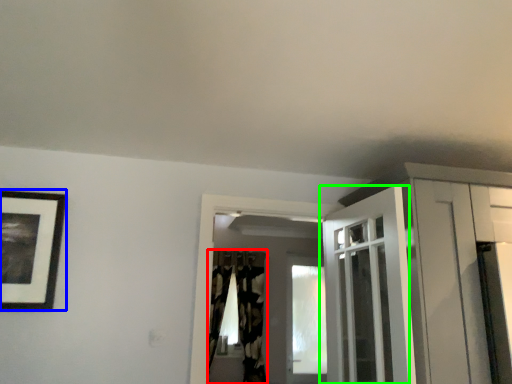
Question: Considering the real-world distances, which object is closest to curtain (highlighted by a red box)? picture frame (highlighted by a blue box) or door (highlighted by a green box).

Choices:
 (A) picture frame
 (B) door

Answer: (B)